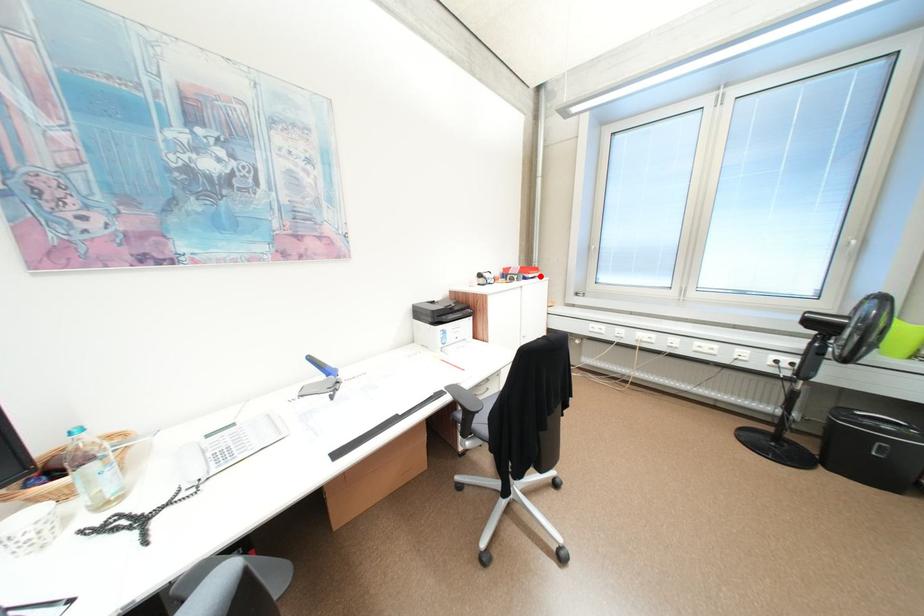
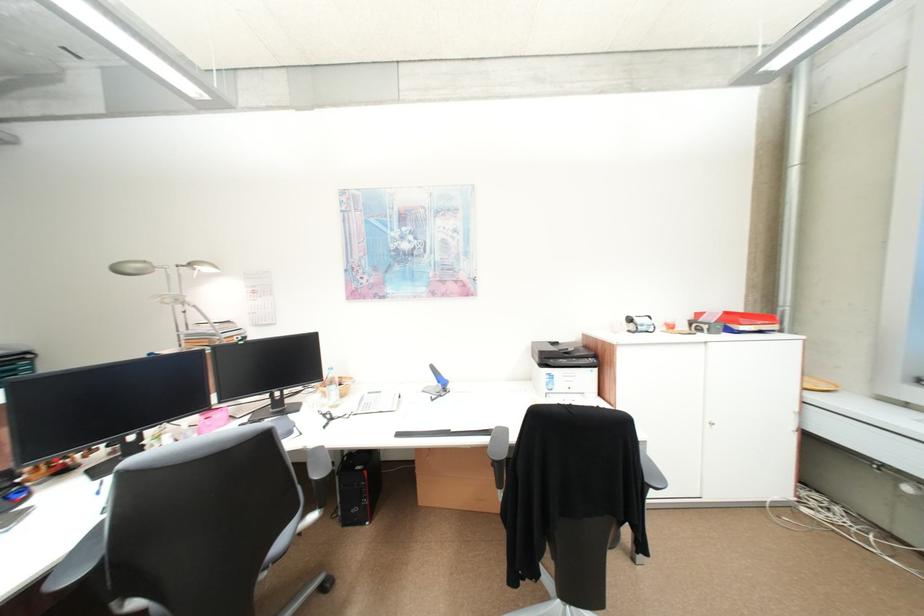
Question: I am providing you with two images of the same scene from different viewpoints. A red point is marked on the first image. At the location where the point appears in image 1, is it still visible in image 2?

Choices:
 (A) Yes
 (B) No

Answer: (A)